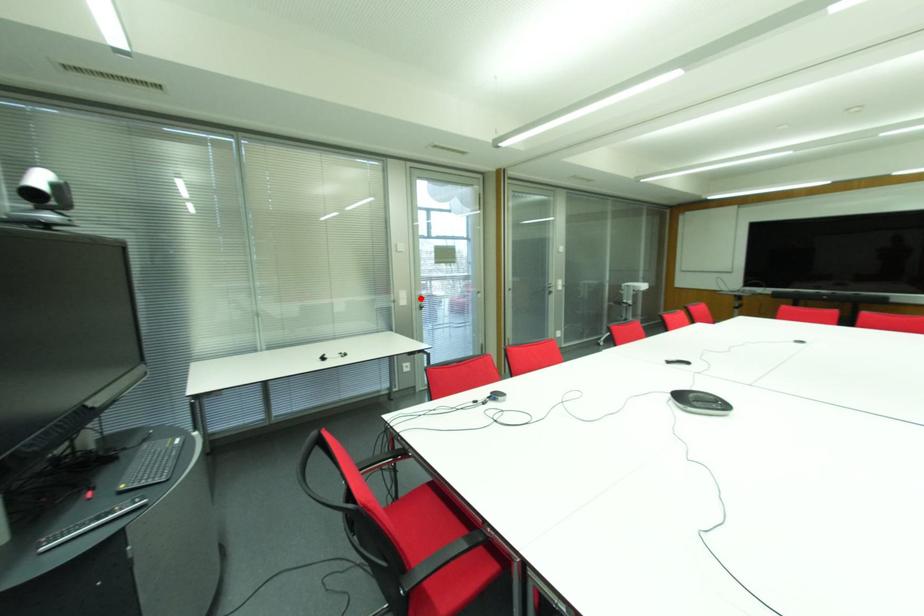
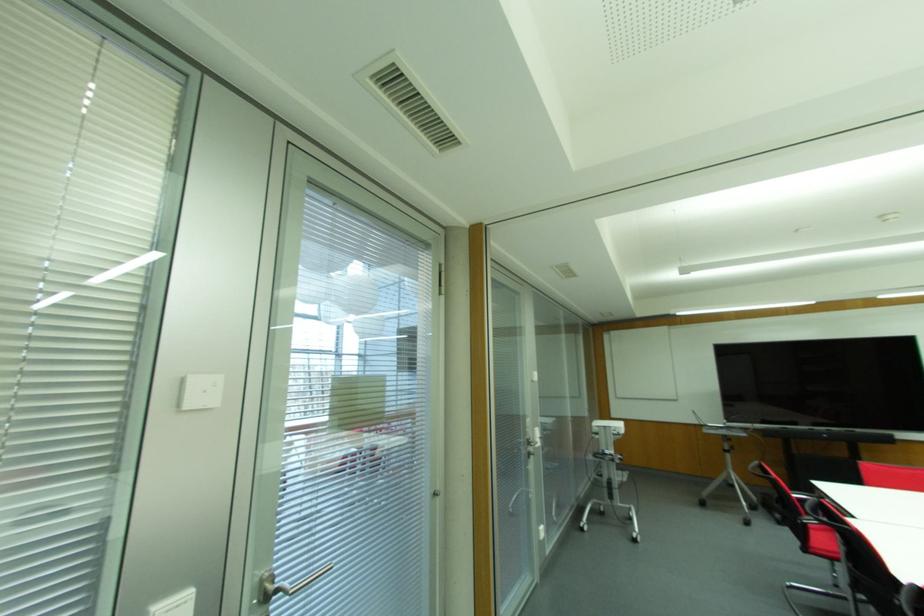
Find the pixel in the second image that matches the highlighted location in the first image.

(266, 596)